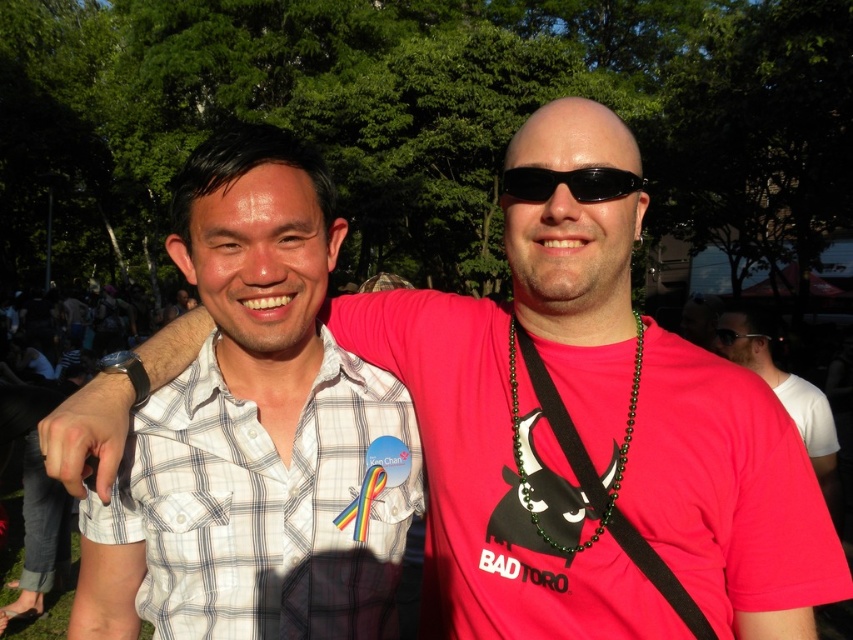
You are standing in a public event and see two people. The person on the left is wearing a white and gray plaid shirt with a rainbow ribbon, and the person on the right is wearing a bright pink Tshirt with a black bull head graphic. There is a point marked at coordinates (782, 388). Which object does this point correspond to?

The point at coordinates (782, 388) corresponds to the matte pink shirt at center.